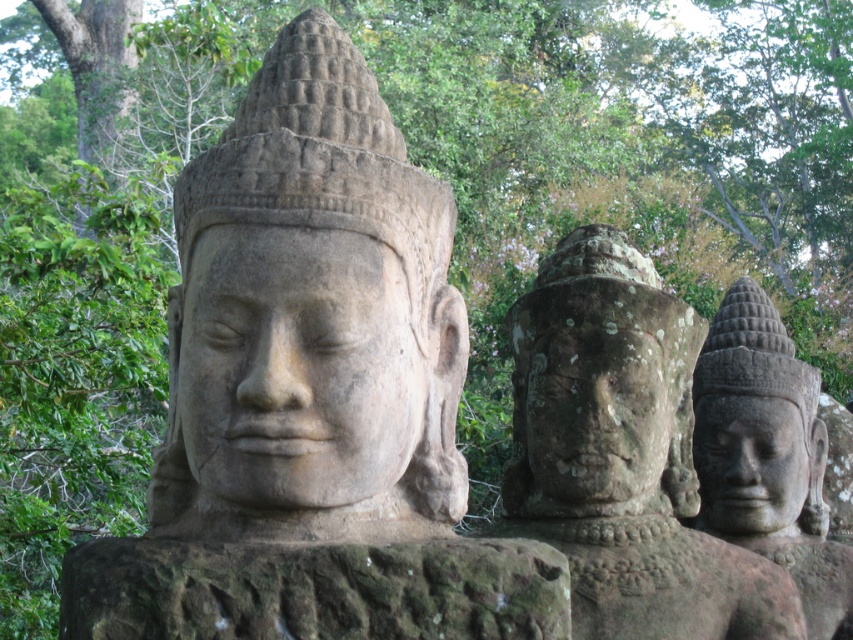
You are an archaeologist examining the stone sculptures in the scene. You need to determine which object is taller between the gray stone statue at center and the gray stone face at right. Based on the scene, which one is taller?

The gray stone statue at center is taller than the gray stone face at right.

You are an archaeologist examining the stone sculptures. You notice the gray stone statue at center and the gray stone face at right. Which one is larger in size?

The gray stone face at right is larger in size compared to the gray stone statue at center.

You are an archaeologist examining the ancient temple site. You notice the green mossy rock at center and the gray stone head at right. Which object is closer to you as you stand at the entrance of the temple?

The green mossy rock at center is closer to you because it is in front of the gray stone head at right, meaning the gray stone head at right is further back.